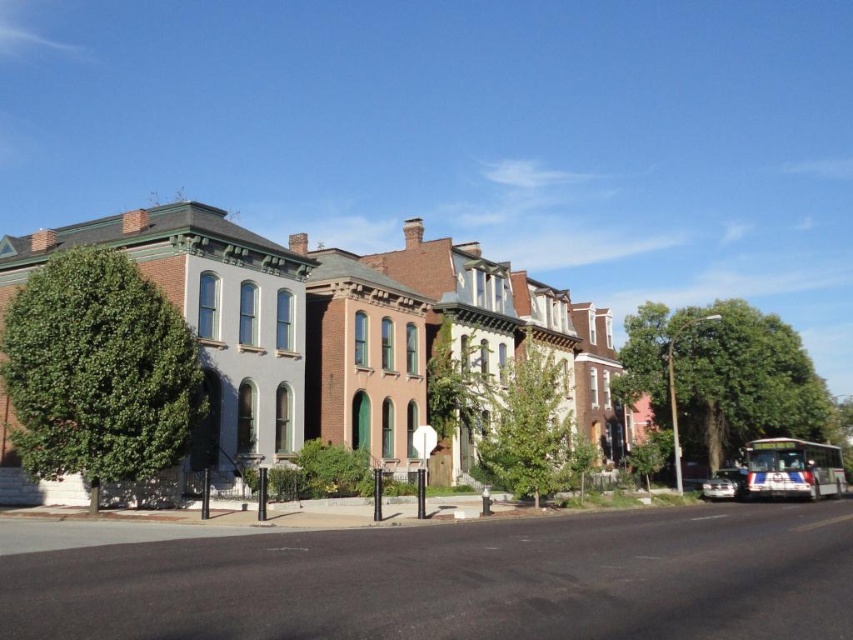
Who is taller, green leafy tree at center or shiny silver car at lower right?

With more height is green leafy tree at center.

Is green leafy tree at center taller than shiny silver car at lower right?

Yes, green leafy tree at center is taller than shiny silver car at lower right.

Is point (537, 401) behind point (732, 497)?

That is False.

Locate an element on the screen. The width and height of the screenshot is (853, 640). green leafy tree at center is located at coordinates [527, 426].

Which is more to the left, green leafy tree at left or shiny silver car at lower right?

green leafy tree at left is more to the left.

This screenshot has width=853, height=640. Describe the element at coordinates (97, 371) in the screenshot. I see `green leafy tree at left` at that location.

Identify the location of green leafy tree at left. This screenshot has height=640, width=853. (97, 371).

Which is more to the left, green leafy tree at right or shiny silver car at lower right?

shiny silver car at lower right is more to the left.

The image size is (853, 640). Describe the element at coordinates (723, 376) in the screenshot. I see `green leafy tree at right` at that location.

This screenshot has width=853, height=640. In order to click on green leafy tree at right in this screenshot , I will do tap(723, 376).